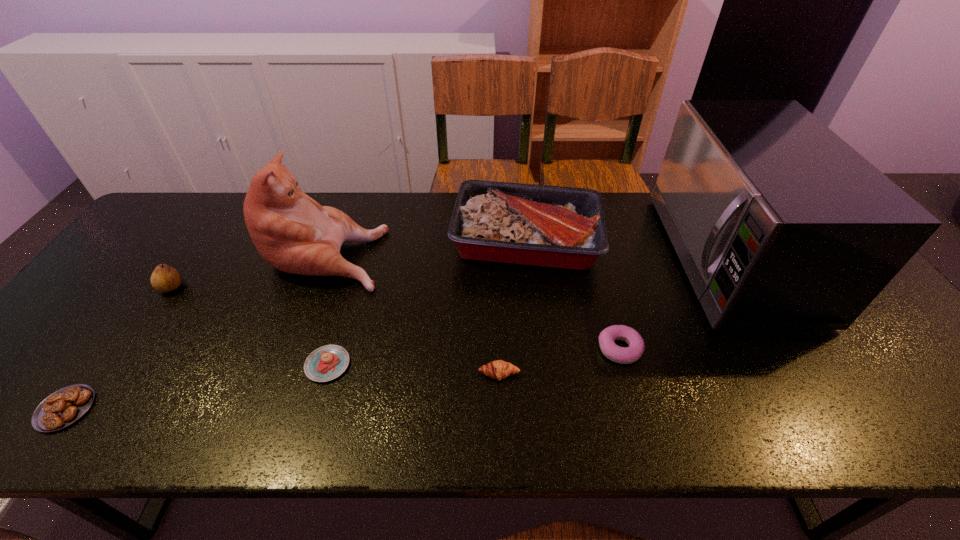
This screenshot has width=960, height=540. In order to click on vacant space that is in between the third pastry from right to left and the cat in this screenshot , I will do `click(327, 308)`.

Where is `blank region between the nearest pastry and the third pastry from right to left`? blank region between the nearest pastry and the third pastry from right to left is located at coordinates (197, 387).

Locate an element on the screen. This screenshot has width=960, height=540. free space between the second pastry from right to left and the cat is located at coordinates (413, 313).

Locate an element on the screen. This screenshot has height=540, width=960. unoccupied area between the nearest pastry and the cat is located at coordinates tap(197, 330).

The image size is (960, 540). What are the coordinates of `blank region between the second pastry from left to right and the third tallest object` in the screenshot? It's located at (427, 302).

Find the location of a particular element. The image size is (960, 540). free space between the leftmost pastry and the cat is located at coordinates (197, 330).

The image size is (960, 540). I want to click on vacant area between the third tallest object and the cat, so click(x=427, y=246).

Where is `free point between the second pastry from right to left and the microwave oven`? free point between the second pastry from right to left and the microwave oven is located at coordinates (612, 315).

This screenshot has height=540, width=960. Identify the location of vacant area between the pear and the nearest pastry. (119, 348).

The image size is (960, 540). Identify the location of object that can be found as the fifth closest to the cat. (498, 369).